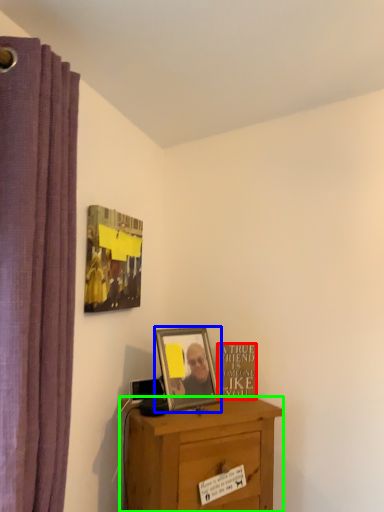
Question: Which object is the closest to the writing (highlighted by a red box)? Choose among these: picture frame (highlighted by a blue box) or desk (highlighted by a green box).

Choices:
 (A) picture frame
 (B) desk

Answer: (A)